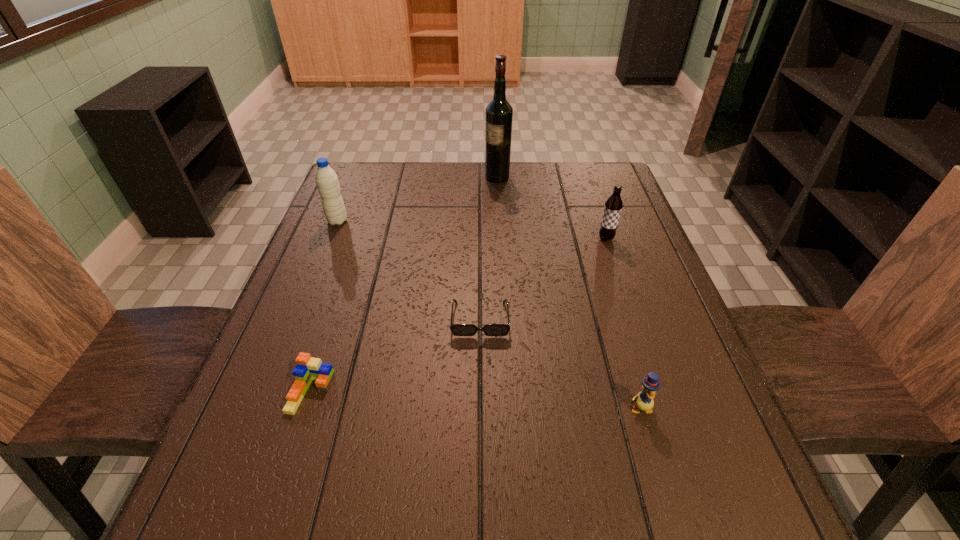
At what (x,y) coordinates should I click in order to perform the action: click on the closest object to the duckling. Please return your answer as a coordinate pair (x, y). The width and height of the screenshot is (960, 540). Looking at the image, I should click on (457, 329).

You are a GUI agent. You are given a task and a screenshot of the screen. Output one action in this format:
    pyautogui.click(x=<x>, y=<y>)
    Task: Click on the object that is the second closest to the farthest object
    The image size is (960, 540).
    Given the screenshot: What is the action you would take?
    pyautogui.click(x=326, y=179)

Identify the location of vacant space that satisfies the following two spatial constraints: 1. on the front side of the water bottle; 2. on the left side of the root beer. (330, 238).

Locate an element on the screen. vacant area in the image that satisfies the following two spatial constraints: 1. on the front and back of the wine bottle; 2. on the left side of the third farthest object is located at coordinates (501, 238).

The height and width of the screenshot is (540, 960). Identify the location of free location that satisfies the following two spatial constraints: 1. on the front side of the fifth nearest object; 2. on the left side of the second shortest object. (269, 392).